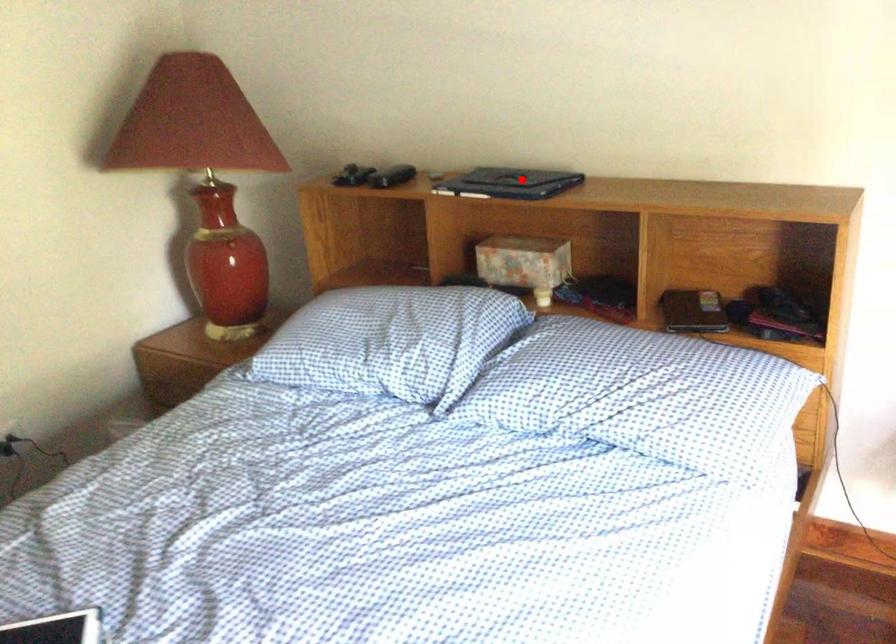
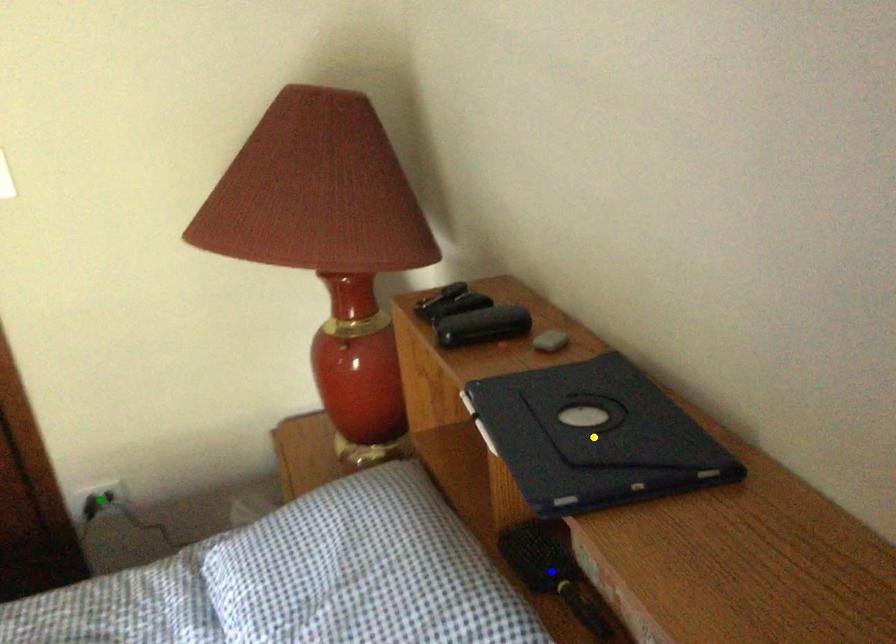
Question: I am providing you with two images of the same scene from different viewpoints. A red point is marked on the first image. You are given multiple points on the second image. Which point in image 2 represents the same 3d spot as the red point in image 1?

Choices:
 (A) blue point
 (B) green point
 (C) yellow point

Answer: (C)